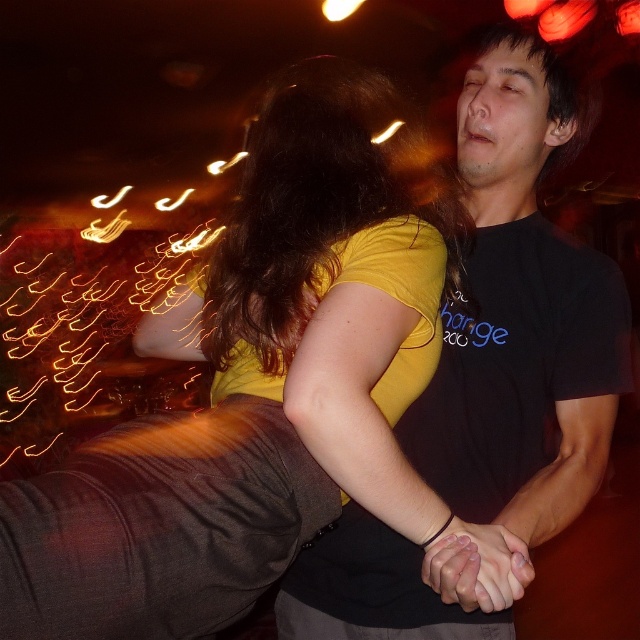
Is brown shiny hair at upper center wider than smooth skin hands at center?

Yes, brown shiny hair at upper center is wider than smooth skin hands at center.

Is brown shiny hair at upper center positioned at the back of smooth skin hands at center?

Yes.

Describe the element at coordinates (314, 205) in the screenshot. The height and width of the screenshot is (640, 640). I see `brown shiny hair at upper center` at that location.

Locate an element on the screen. This screenshot has width=640, height=640. brown shiny hair at upper center is located at coordinates (314, 205).

Is black matte t-shirt at center to the right of smooth skin hands at center from the viewer's perspective?

Yes, black matte t-shirt at center is to the right of smooth skin hands at center.

I want to click on black matte t-shirt at center, so click(522, 308).

Does black matte t-shirt at center appear on the left side of brown shiny hair at upper center?

No, black matte t-shirt at center is not to the left of brown shiny hair at upper center.

This screenshot has width=640, height=640. I want to click on black matte t-shirt at center, so click(x=522, y=308).

This screenshot has height=640, width=640. Find the location of `black matte t-shirt at center`. black matte t-shirt at center is located at coordinates (522, 308).